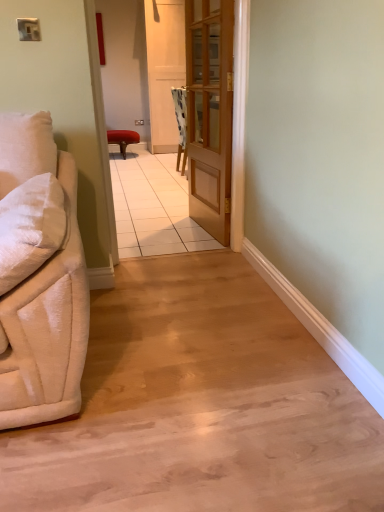
Find the location of `wooden door at center`. wooden door at center is located at coordinates (142, 66).

Measure the distance between velvet beige couch at left and camera.

velvet beige couch at left is 3.71 feet from camera.

What do you see at coordinates (123, 139) in the screenshot? I see `matte red stool at center` at bounding box center [123, 139].

Locate an element on the screen. wooden door at center is located at coordinates (210, 112).

Is matte red stool at center situated inside velvet beige couch at left or outside?

matte red stool at center lies outside velvet beige couch at left.

Is matte red stool at center not near velvet beige couch at left?

Indeed, matte red stool at center is not near velvet beige couch at left.

Considering the positions of objects matte red stool at center and velvet beige couch at left in the image provided, who is more to the right, matte red stool at center or velvet beige couch at left?

Positioned to the right is velvet beige couch at left.

From a real-world perspective, which object rests below the other?

wooden door at center is physically lower.

Are wooden door at center and wooden door at center far apart?

wooden door at center is far away from wooden door at center.

Is wooden door at center positioned beyond the bounds of wooden door at center?

Yes, wooden door at center is not within wooden door at center.

Is wooden door at center beside wooden screen door at center?

No, wooden door at center is not beside wooden screen door at center.

From their relative heights in the image, would you say wooden door at center is taller or shorter than wooden screen door at center?

wooden door at center is shorter than wooden screen door at center.

From the image's perspective, which is above, wooden door at center or wooden screen door at center?

wooden screen door at center is shown above in the image.

Can you tell me how much wooden door at center and wooden screen door at center differ in facing direction?

The angular difference between wooden door at center and wooden screen door at center is 3.62 degrees.

In the scene shown: Which of these two, wooden door at center or velvet beige couch at left, is wider?

Wider between the two is velvet beige couch at left.

Which point is more forward, (202, 14) or (68, 234)?

Positioned in front is point (68, 234).

Based on their sizes in the image, would you say wooden door at center is bigger or smaller than velvet beige couch at left?

Considering their sizes, wooden door at center takes up less space than velvet beige couch at left.

In the scene shown: Is wooden door at center touching velvet beige couch at left?

No, wooden door at center is not touching velvet beige couch at left.

From a real-world perspective, which object stands above the other?

wooden door at center, from a real-world perspective.

How different are the orientations of velvet beige couch at left and wooden door at center in degrees?

There is a 83.9-degree angle between the facing directions of velvet beige couch at left and wooden door at center.

What are the coordinates of `corridor above the velvet beige couch at left (from the image's perspective)` in the screenshot? It's located at pos(142,66).

Considering the points (19, 228) and (168, 132), which point is in front, point (19, 228) or point (168, 132)?

The point (19, 228) is closer to the camera.

Would you say wooden screen door at center is to the left or to the right of wooden door at center in the picture?

Based on their positions, wooden screen door at center is located to the left of wooden door at center.

From the image's perspective, is wooden screen door at center positioned above or below wooden door at center?

From the image's perspective, wooden screen door at center appears above wooden door at center.

Identify the location of screen door that is above the wooden door at center (from the image's perspective). (164, 69).

Which of these two, wooden screen door at center or wooden door at center, stands shorter?

Standing shorter between the two is wooden door at center.

Is matte red stool at center not near wooden door at center?

Indeed, matte red stool at center is not near wooden door at center.

Is matte red stool at center aimed at wooden door at center?

Yes, matte red stool at center is aimed at wooden door at center.

Can you confirm if matte red stool at center is positioned to the right of wooden door at center?

No, matte red stool at center is not to the right of wooden door at center.

In terms of size, does matte red stool at center appear bigger or smaller than wooden door at center?

Clearly, matte red stool at center is larger in size than wooden door at center.

The width and height of the screenshot is (384, 512). Find the location of `studio couch in front of the matte red stool at center`. studio couch in front of the matte red stool at center is located at coordinates (39, 276).

The width and height of the screenshot is (384, 512). I want to click on door above the wooden door at center (from the image's perspective), so click(x=210, y=112).

From the image, which object appears to be farther from wooden door at center, velvet beige couch at left or wooden screen door at center?

The object further to wooden door at center is wooden screen door at center.

Estimate the real-world distances between objects in this image. Which object is further from wooden door at center, wooden door at center or wooden screen door at center?

Based on the image, wooden door at center appears to be further to wooden door at center.

Based on their spatial positions, is wooden door at center or wooden screen door at center further from matte red stool at center?

wooden door at center is further to matte red stool at center.

Looking at the image, which one is located further to wooden door at center, wooden door at center or wooden screen door at center?

Based on the image, wooden door at center appears to be further to wooden door at center.

Based on their spatial positions, is wooden screen door at center or velvet beige couch at left closer to matte red stool at center?

wooden screen door at center is positioned closer to the anchor matte red stool at center.

When comparing their distances from wooden door at center, does matte red stool at center or wooden screen door at center seem further?

matte red stool at center lies further to wooden door at center than the other object.

From the image, which object appears to be nearer to velvet beige couch at left, wooden door at center or matte red stool at center?

matte red stool at center is closer to velvet beige couch at left.

Considering their positions, is wooden screen door at center positioned closer to matte red stool at center than wooden door at center?

Based on the image, wooden screen door at center appears to be nearer to matte red stool at center.

Where is `door between wooden door at center and wooden screen door at center from front to back`? door between wooden door at center and wooden screen door at center from front to back is located at coordinates (210, 112).

Identify the location of door between wooden door at center and matte red stool at center along the z-axis. The image size is (384, 512). (210, 112).

The height and width of the screenshot is (512, 384). Find the location of `corridor between velvet beige couch at left and matte red stool at center from front to back`. corridor between velvet beige couch at left and matte red stool at center from front to back is located at coordinates (142, 66).

Find the location of a particular element. The height and width of the screenshot is (512, 384). corridor between velvet beige couch at left and wooden screen door at center in the front-back direction is located at coordinates (142, 66).